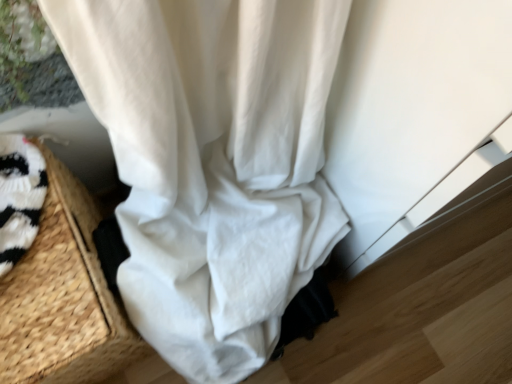
Question: Considering the relative positions of white cotton curtain at center and woven straw basket at lower left in the image provided, is white cotton curtain at center to the right of woven straw basket at lower left from the viewer's perspective?

Choices:
 (A) no
 (B) yes

Answer: (B)

Question: Considering the relative sizes of white cotton curtain at center and woven straw basket at lower left in the image provided, is white cotton curtain at center shorter than woven straw basket at lower left?

Choices:
 (A) yes
 (B) no

Answer: (A)

Question: Is white cotton curtain at center bigger than woven straw basket at lower left?

Choices:
 (A) no
 (B) yes

Answer: (A)

Question: Considering the relative positions of white cotton curtain at center and woven straw basket at lower left in the image provided, is white cotton curtain at center to the left of woven straw basket at lower left from the viewer's perspective?

Choices:
 (A) yes
 (B) no

Answer: (B)

Question: From the image's perspective, does white cotton curtain at center appear lower than woven straw basket at lower left?

Choices:
 (A) no
 (B) yes

Answer: (A)

Question: Does white cotton curtain at center lie in front of woven straw basket at lower left?

Choices:
 (A) yes
 (B) no

Answer: (B)

Question: From a real-world perspective, is woven straw basket at lower left on white cotton curtain at center?

Choices:
 (A) no
 (B) yes

Answer: (B)

Question: Is woven straw basket at lower left smaller than white cotton curtain at center?

Choices:
 (A) no
 (B) yes

Answer: (A)

Question: Is woven straw basket at lower left positioned before white cotton curtain at center?

Choices:
 (A) yes
 (B) no

Answer: (A)

Question: Is white cotton curtain at center surrounded by woven straw basket at lower left?

Choices:
 (A) no
 (B) yes

Answer: (A)

Question: Is the depth of woven straw basket at lower left greater than that of white cotton curtain at center?

Choices:
 (A) no
 (B) yes

Answer: (A)

Question: Can you confirm if woven straw basket at lower left is bigger than white cotton curtain at center?

Choices:
 (A) no
 (B) yes

Answer: (B)

Question: From the image's perspective, is white cotton curtain at center positioned above or below woven straw basket at lower left?

Choices:
 (A) above
 (B) below

Answer: (A)